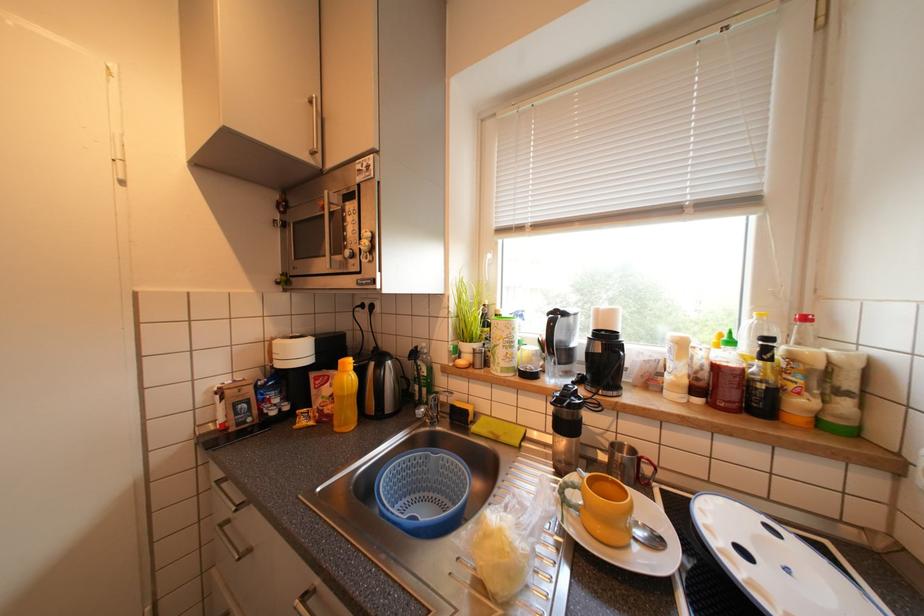
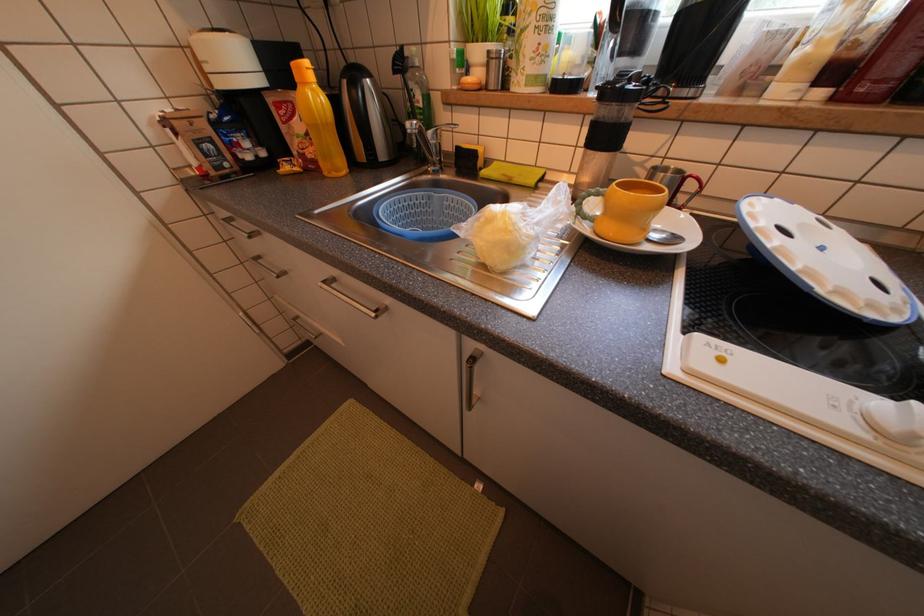
Question: How did the camera likely rotate?

Choices:
 (A) Left
 (B) Right
 (C) Up
 (D) Down

Answer: (D)